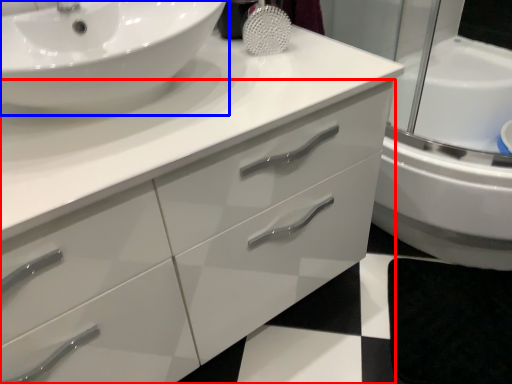
Question: Which object is closer to the camera taking this photo, bathroom cabinet (highlighted by a red box) or sink (highlighted by a blue box)?

Choices:
 (A) bathroom cabinet
 (B) sink

Answer: (A)